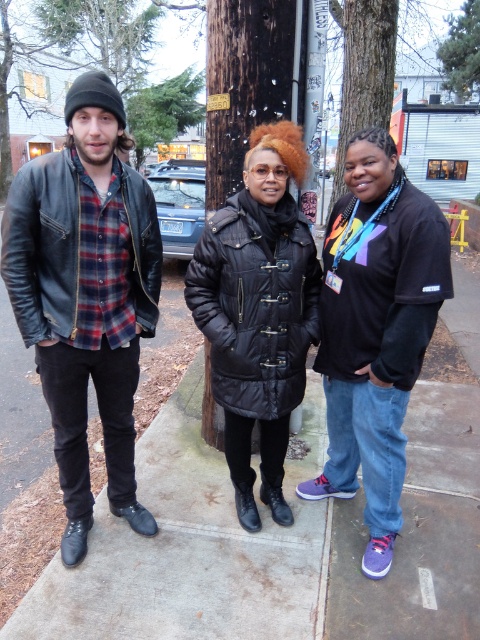
You are a photographer trying to capture a photo of the two people in the scene. You want to ensure that both the leather jacket at left and the black quilted coat at center are clearly visible in the frame. Based on their positions, which person should you focus on first to ensure both are in focus?

The leather jacket at left is located above the black quilted coat at center. Therefore, you should focus on the person wearing the leather jacket at left first, as they are closer to the camera, ensuring both will be in focus.